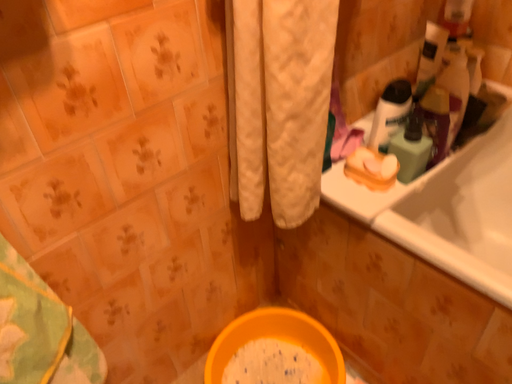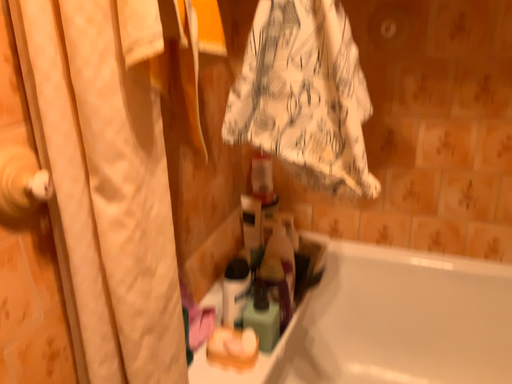
Question: Which way did the camera rotate in the video?

Choices:
 (A) rotated upward
 (B) rotated downward

Answer: (A)